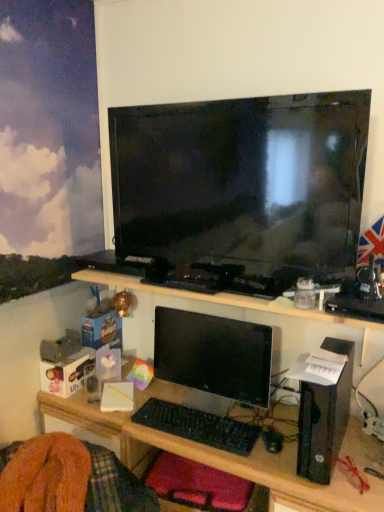
Question: In terms of height, does black glossy tv at upper center look taller or shorter compared to velvet-like red cushion at lower center?

Choices:
 (A) tall
 (B) short

Answer: (A)

Question: Is black glossy tv at upper center wider or thinner than velvet-like red cushion at lower center?

Choices:
 (A) wide
 (B) thin

Answer: (B)

Question: Which is nearer to the black glossy tv at upper center?

Choices:
 (A) black glossy monitor at center
 (B) black plastic monitor at center
 (C) black plastic mouse at lower center
 (D) black plastic keyboard at center
 (E) black plastic computer at right

Answer: (A)

Question: Considering the real-world distances, which object is farthest from the black plastic monitor at center?

Choices:
 (A) black plastic mouse at lower center
 (B) black glossy tv at upper center
 (C) black plastic keyboard at center
 (D) black plastic computer at right
 (E) black glossy monitor at center

Answer: (B)